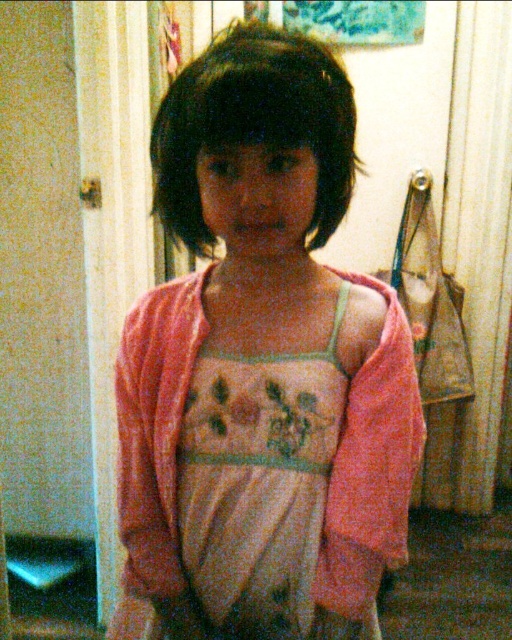
Based on the photo, the child is holding a toy that is 15 cm wide. The toy needs to be placed between the pink soft fabric dress at center and the dark matte hair at center. Can the toy fit in that space?

The pink soft fabric dress at center is positioned on the right side of dark matte hair at center, so the space between them is available. Since the toy is 15 cm wide, we need to know the distance between the two objects. However, the description does not provide the exact distance. Therefore, it is uncertain if the toy will fit without additional information.

Based on the scene description, where is the pink soft fabric dress at center located in terms of coordinates?

The pink soft fabric dress at center is located at coordinates point (262, 368).

The child is wearing a light pink fabric dress at center and has dark matte hair at center. Which part of the child is taller?

The light pink fabric dress at center is taller than the dark matte hair at center.